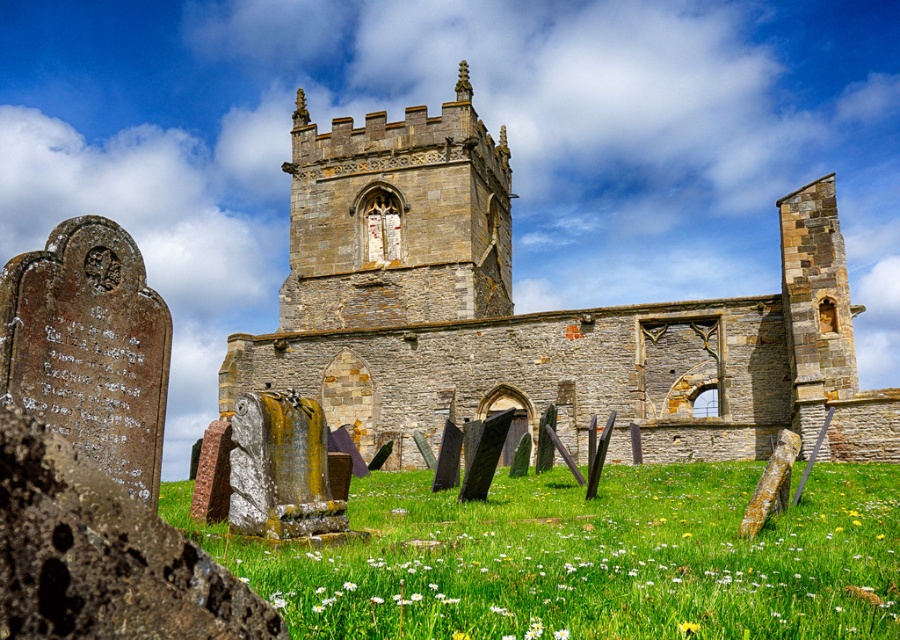
You are a photographer planning to capture the gray stone church at center and the green grassy field at lower center in a single frame. Based on their sizes, which object should you focus on to ensure both fit well in the composition?

The gray stone church at center might be wider than the green grassy field at lower center, so focusing on the church would help ensure both fit well in the composition since it occupies more horizontal space.

Based on the photo, you are a photographer planning to take a picture of the gray stone church at center and the green grassy field at lower center. Based on the scene description, which object should appear closer to the camera in your photo?

The gray stone church at center should appear closer to the camera because the green grassy field at lower center is behind it.